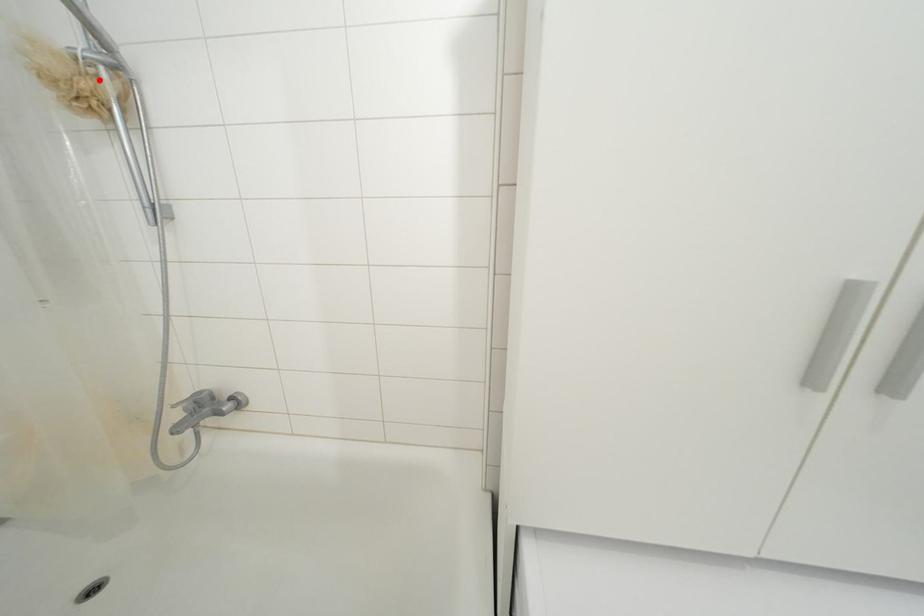
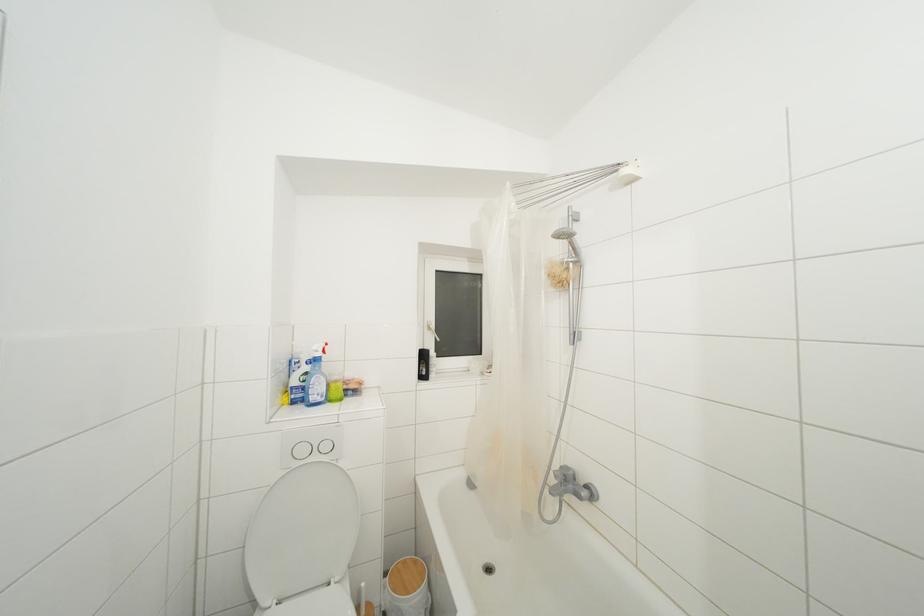
Find the pixel in the second image that matches the highlighted location in the first image.

(572, 273)